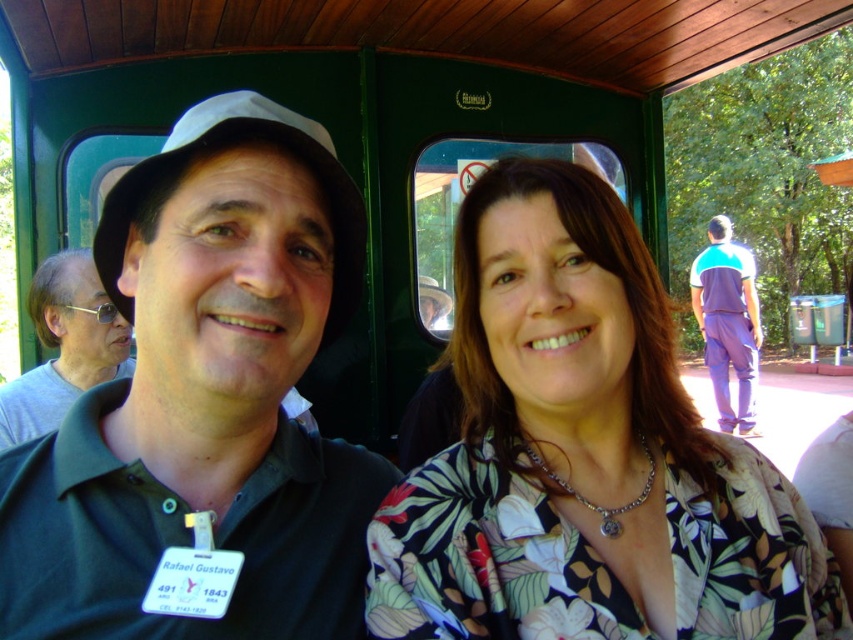
You are a photographer on a train and want to capture a photo of the black matte hat at upper left and the purple cotton pants at right. The camera you are using has a maximum focus range of 5 meters. Will both objects be in focus?

The black matte hat at upper left is 5.91 meters away from purple cotton pants at right. Since the distance between them exceeds the camera maximum focus range of 5 meters, the camera cannot focus on both objects simultaneously.

You are a photographer trying to capture a clear shot of the floral print blouse at center and the black matte hat at upper left. Which object should you focus on first if you want to ensure both are in focus without adjusting the camera settings?

The floral print blouse at center has a lesser height compared to black matte hat at upper left, so you should focus on the black matte hat at upper left first since it is taller and likely farther away, ensuring depth of field covers both.